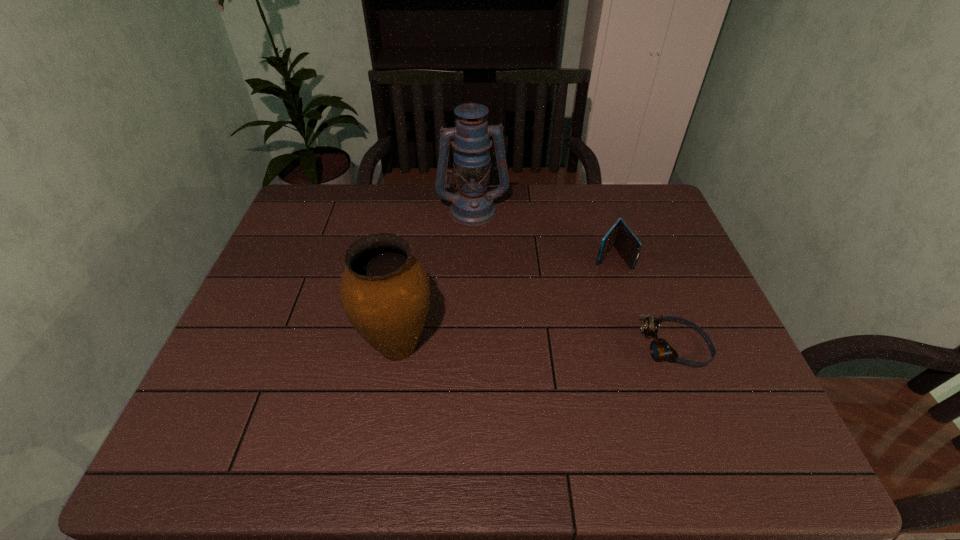
Find the location of a particular element. The width and height of the screenshot is (960, 540). blank area located on the front-facing side of the farthest object is located at coordinates (495, 323).

Locate an element on the screen. vacant space located on the front-facing side of the farthest object is located at coordinates (486, 272).

Identify the location of free space located 0.210m on the front-facing side of the farthest object. This screenshot has width=960, height=540. (486, 272).

You are a GUI agent. You are given a task and a screenshot of the screen. Output one action in this format:
    pyautogui.click(x=<x>, y=<y>)
    Task: Click on the object located at the far edge
    Image resolution: width=960 pixels, height=540 pixels.
    Given the screenshot: What is the action you would take?
    pyautogui.click(x=472, y=205)

Find the location of a particular element. object positioned at the near edge is located at coordinates (385, 292).

Identify the location of object at the right edge. Image resolution: width=960 pixels, height=540 pixels. (660, 349).

You are a GUI agent. You are given a task and a screenshot of the screen. Output one action in this format:
    pyautogui.click(x=<x>, y=<y>)
    Task: Click on the free point at the far edge
    
    Given the screenshot: What is the action you would take?
    pyautogui.click(x=373, y=212)

This screenshot has width=960, height=540. In the image, there is a desktop. Find the location of `vacant region at the near edge`. vacant region at the near edge is located at coordinates (317, 387).

Locate an element on the screen. This screenshot has height=540, width=960. vacant space at the left edge of the desktop is located at coordinates (314, 284).

This screenshot has height=540, width=960. In the image, there is a desktop. What are the coordinates of `vacant space at the right edge` in the screenshot? It's located at (660, 296).